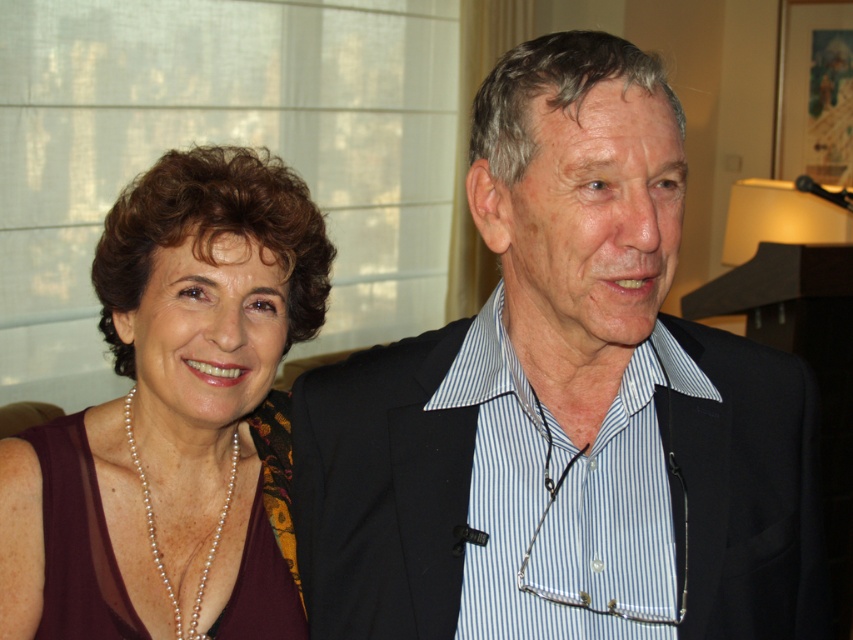
You are at a party and want to take a photo of the black striped shirt at center and the maroon fabric dress at left. Which one should you focus on if you want to capture the one higher up in the frame?

Result: The black striped shirt at center is above the maroon fabric dress at left, so you should focus on the black striped shirt at center to capture the one higher up in the frame.

You are at a party and want to hand a drink to the person wearing the black striped shirt at center and the maroon fabric dress at left. Which one can you reach first without moving?

The black striped shirt at center is closer to the viewer than the maroon fabric dress at left, so you can reach the person wearing the black striped shirt at center first without moving.

You are standing in front of the two people in the image. Which of the two points, point (593, 141) or point (131, 368), is closer to you?

Point (593, 141) is closer to the viewer than point (131, 368).